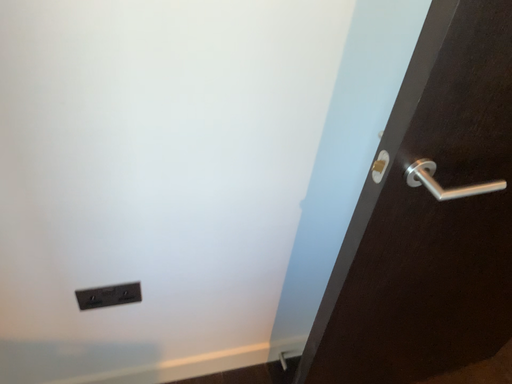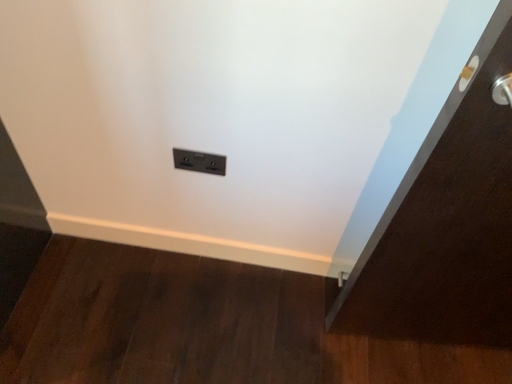
Question: How did the camera likely rotate when shooting the video?

Choices:
 (A) rotated left
 (B) rotated right

Answer: (A)